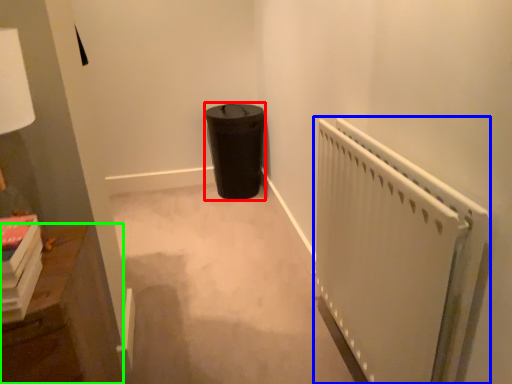
Question: Estimate the real-world distances between objects in this image. Which object is closer to garbage (highlighted by a red box), radiator (highlighted by a blue box) or furniture (highlighted by a green box)?

Choices:
 (A) radiator
 (B) furniture

Answer: (A)